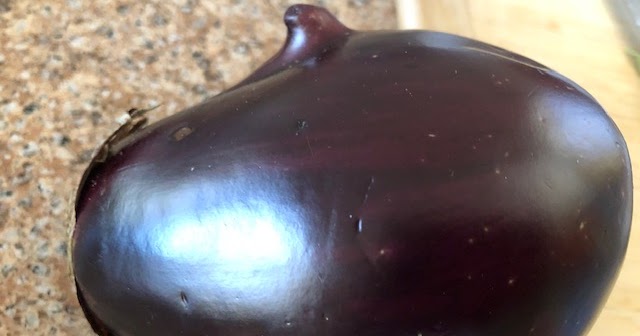
You are a GUI agent. You are given a task and a screenshot of the screen. Output one action in this format:
    pyautogui.click(x=<x>, y=<y>)
    Task: Click on the countertop
    The width and height of the screenshot is (640, 336).
    Given the screenshot: What is the action you would take?
    pyautogui.click(x=86, y=72)